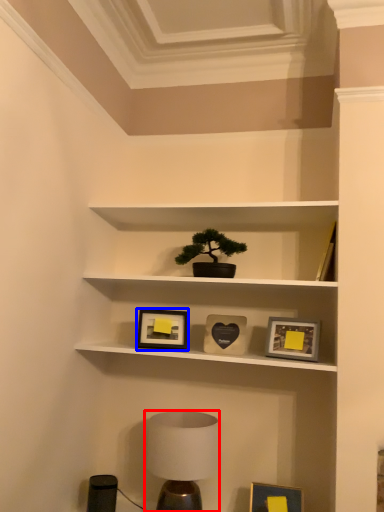
Question: Which point is closer to the camera, table lamp (highlighted by a red box) or picture frame (highlighted by a blue box)?

Choices:
 (A) table lamp
 (B) picture frame

Answer: (A)